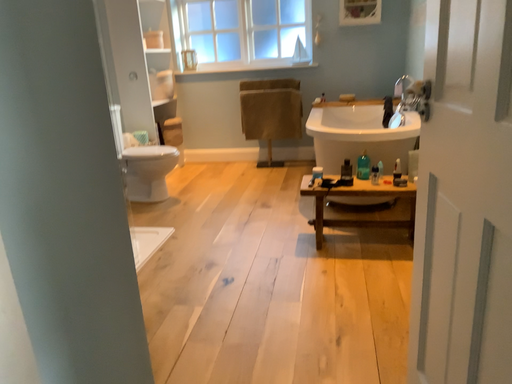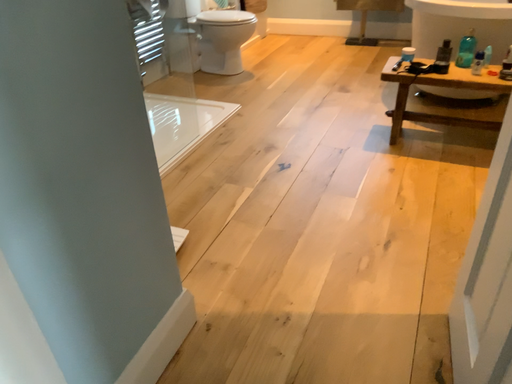
Question: Which way did the camera rotate in the video?

Choices:
 (A) rotated right
 (B) rotated left

Answer: (B)